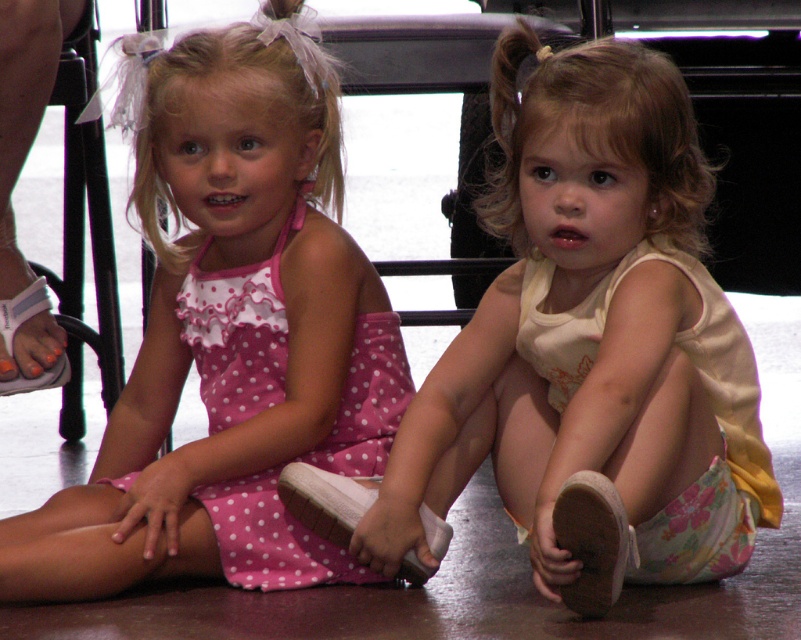
Question: Estimate the real-world distances between objects in this image. Which object is closer to the white fabric sandal at left?

Choices:
 (A) white fabric shoe at lower right
 (B) pink polka dot dress at left

Answer: (B)

Question: Is white fabric dress at center thinner than pink polka dot dress at left?

Choices:
 (A) no
 (B) yes

Answer: (A)

Question: Which point is farther from the camera taking this photo?

Choices:
 (A) (45, 378)
 (B) (389, 433)
 (C) (562, 276)

Answer: (A)

Question: In this image, where is white suede sandal at lower center located relative to white fabric sandal at left?

Choices:
 (A) left
 (B) right

Answer: (B)

Question: Does white fabric shoe at lower right come behind white fabric sandal at left?

Choices:
 (A) yes
 (B) no

Answer: (B)

Question: Which object appears closest to the camera in this image?

Choices:
 (A) white fabric dress at center
 (B) white fabric shoe at lower right

Answer: (B)